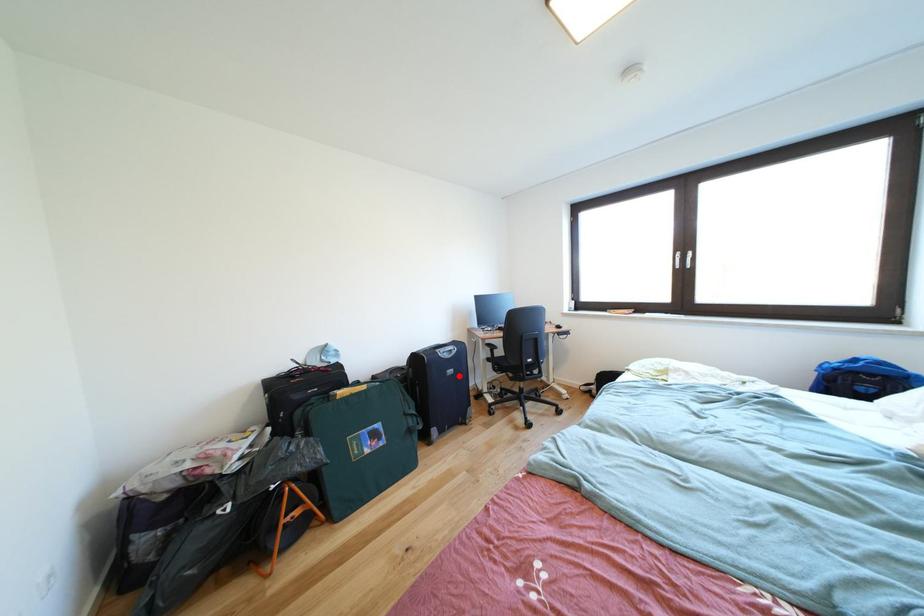
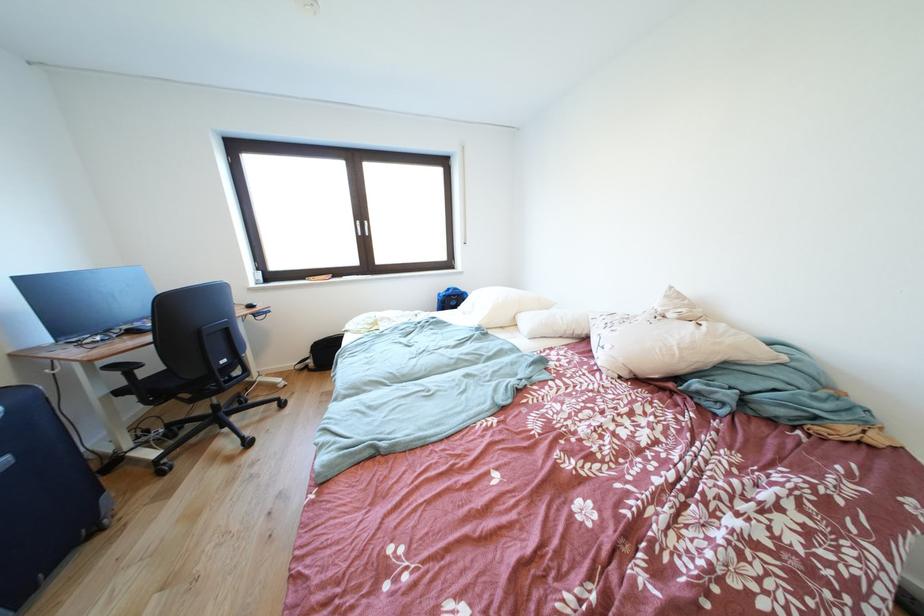
Question: I am providing you with two images of the same scene from different viewpoints. In image1, a red point is highlighted. Considering the same 3D point in image2, which of the following is correct?

Choices:
 (A) It is closer
 (B) It is farther

Answer: (A)